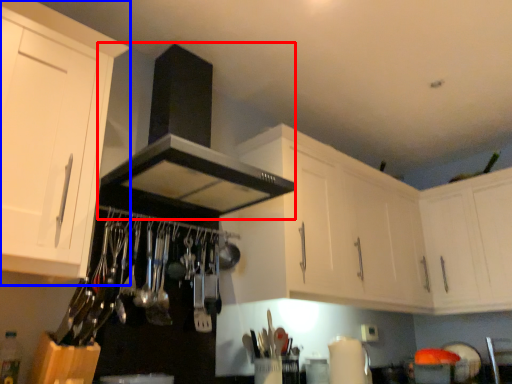
Question: Which object is further to the camera taking this photo, exhaust hood (highlighted by a red box) or cabinetry (highlighted by a blue box)?

Choices:
 (A) exhaust hood
 (B) cabinetry

Answer: (A)